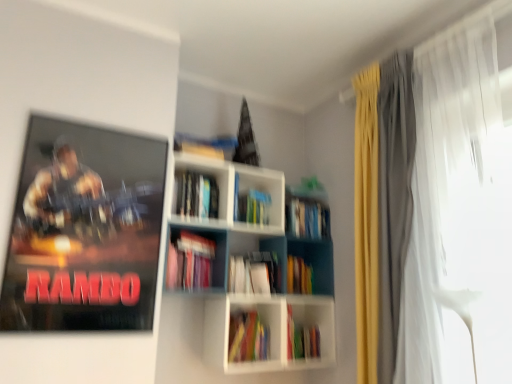
Question: From the image's perspective, would you say multicolored paper book at center, the 3th book positioned from the bottom, is shown under metallic rambo poster at upper left?

Choices:
 (A) no
 (B) yes

Answer: (B)

Question: Is multicolored paper book at center, the 3th book positioned from the bottom, located outside metallic rambo poster at upper left?

Choices:
 (A) yes
 (B) no

Answer: (A)

Question: Is metallic rambo poster at upper left inside multicolored paper book at center, the 3th book positioned from the bottom?

Choices:
 (A) yes
 (B) no

Answer: (B)

Question: Is multicolored paper book at center, acting as the 4th book starting from the top, in front of metallic rambo poster at upper left?

Choices:
 (A) yes
 (B) no

Answer: (B)

Question: Does multicolored paper book at center, the 3th book positioned from the bottom, have a lesser height compared to metallic rambo poster at upper left?

Choices:
 (A) no
 (B) yes

Answer: (B)

Question: From a real-world perspective, does multicolored paper book at center, acting as the 4th book starting from the top, stand above metallic rambo poster at upper left?

Choices:
 (A) yes
 (B) no

Answer: (B)

Question: Is matte pink book at center, acting as the 4th book starting from the bottom, further to camera compared to metallic rambo poster at upper left?

Choices:
 (A) no
 (B) yes

Answer: (B)

Question: Is matte pink book at center, acting as the 4th book starting from the bottom, located outside metallic rambo poster at upper left?

Choices:
 (A) no
 (B) yes

Answer: (B)

Question: Does matte pink book at center, acting as the 4th book starting from the bottom, have a greater width compared to metallic rambo poster at upper left?

Choices:
 (A) yes
 (B) no

Answer: (A)

Question: From the image's perspective, is matte pink book at center, acting as the 4th book starting from the bottom, beneath metallic rambo poster at upper left?

Choices:
 (A) no
 (B) yes

Answer: (B)

Question: Does matte pink book at center, positioned as the third book in top-to-bottom order, touch metallic rambo poster at upper left?

Choices:
 (A) yes
 (B) no

Answer: (B)

Question: Considering the relative sizes of matte pink book at center, positioned as the third book in top-to-bottom order, and metallic rambo poster at upper left in the image provided, is matte pink book at center, positioned as the third book in top-to-bottom order, taller than metallic rambo poster at upper left?

Choices:
 (A) no
 (B) yes

Answer: (A)

Question: From a real-world perspective, is white plastic bookcase at center physically above matte pink book at center, acting as the 4th book starting from the bottom?

Choices:
 (A) yes
 (B) no

Answer: (A)